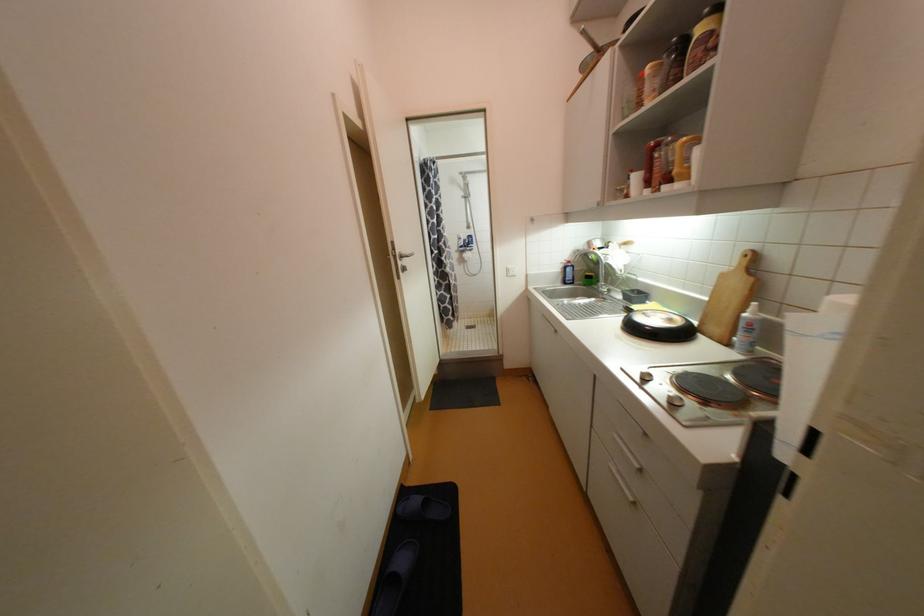
Identify the location of wooden cutting board. This screenshot has width=924, height=616. (728, 300).